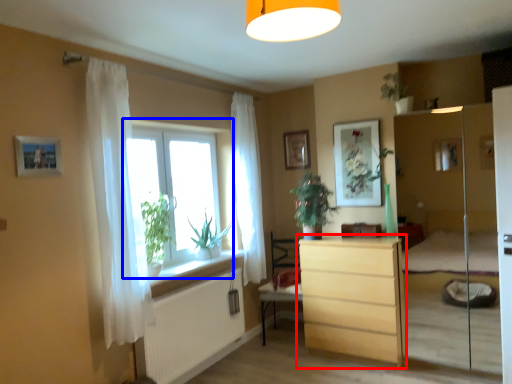
Question: Which point is further to the camera, chest of drawers (highlighted by a red box) or window (highlighted by a blue box)?

Choices:
 (A) chest of drawers
 (B) window

Answer: (A)